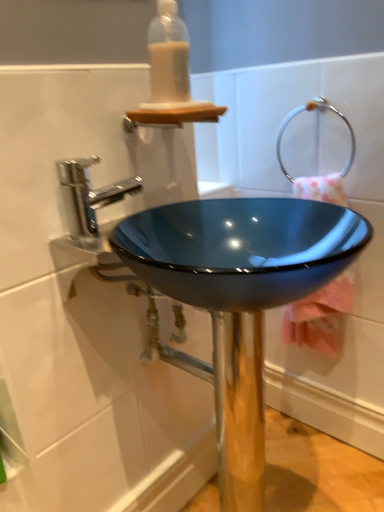
Question: From their relative heights in the image, would you say silver metallic towel ring at upper right is taller or shorter than glossy blue bowl at center?

Choices:
 (A) tall
 (B) short

Answer: (B)

Question: From a real-world perspective, is silver metallic towel ring at upper right above or below glossy blue bowl at center?

Choices:
 (A) below
 (B) above

Answer: (B)

Question: Which object is positioned closest to the translucent plastic bottle at upper center?

Choices:
 (A) glossy blue bowl at center
 (B) silver metallic towel ring at upper right
 (C) polished chrome faucet at upper left
 (D) pink fabric towel at center right

Answer: (C)

Question: Which object is positioned farthest from the silver metallic towel ring at upper right?

Choices:
 (A) pink fabric towel at center right
 (B) polished chrome faucet at upper left
 (C) translucent plastic bottle at upper center
 (D) glossy blue bowl at center

Answer: (B)